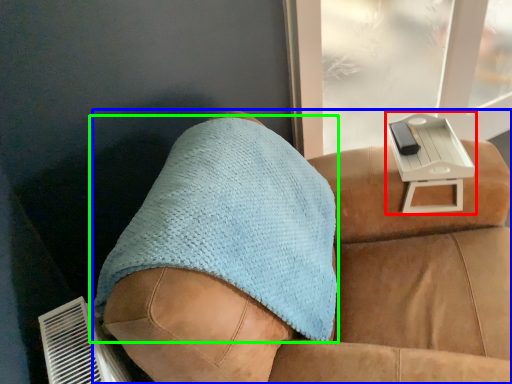
Question: Which object is the closest to the table (highlighted by a red box)? Choose among these: furniture (highlighted by a blue box) or throw pillow (highlighted by a green box).

Choices:
 (A) furniture
 (B) throw pillow

Answer: (A)